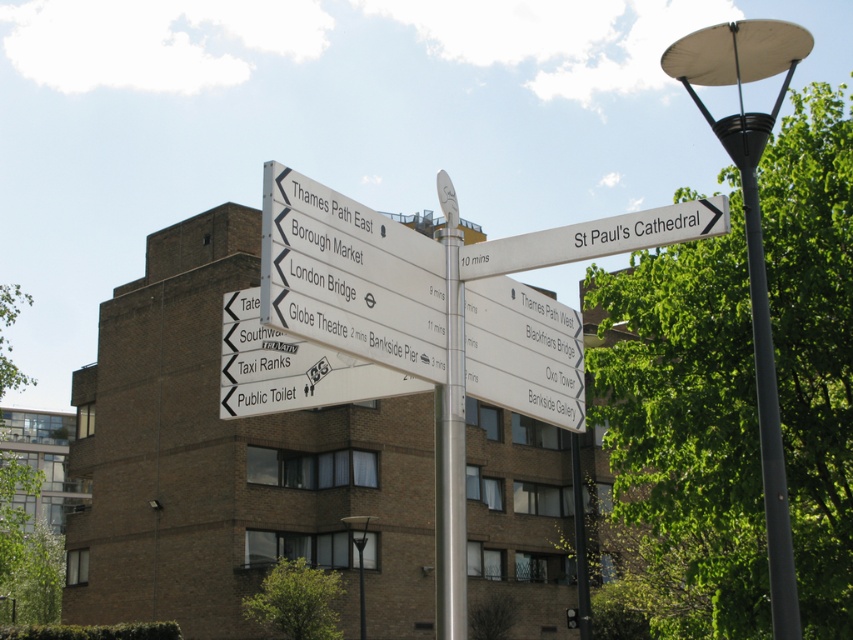
Question: Where is black metal lamp post at upper right located in relation to silver metallic pole at center in the image?

Choices:
 (A) left
 (B) right

Answer: (B)

Question: Among these objects, which one is nearest to the camera?

Choices:
 (A) black metal lamp post at upper right
 (B) white plastic street sign at upper right

Answer: (B)

Question: Which point appears closest to the camera in this image?

Choices:
 (A) pos(775,36)
 (B) pos(454,509)

Answer: (B)

Question: Does black metal lamp post at upper right appear under white plastic street sign at upper right?

Choices:
 (A) yes
 (B) no

Answer: (B)

Question: Which point is closer to the camera?

Choices:
 (A) white plastic street sign at upper right
 (B) black metal lamp post at upper right

Answer: (A)

Question: Can you confirm if silver metallic pole at center is wider than white plastic street sign at upper right?

Choices:
 (A) yes
 (B) no

Answer: (B)